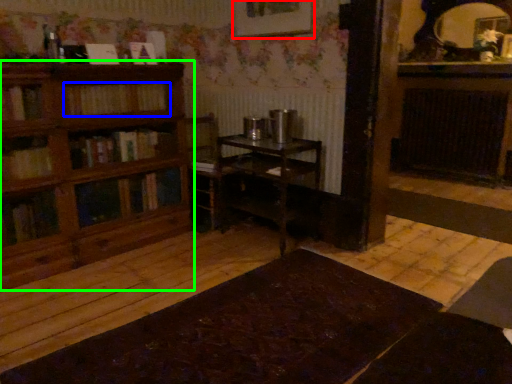
Question: Considering the real-world distances, which object is farthest from picture frame (highlighted by a red box)? book (highlighted by a blue box) or shelf (highlighted by a green box)?

Choices:
 (A) book
 (B) shelf

Answer: (B)